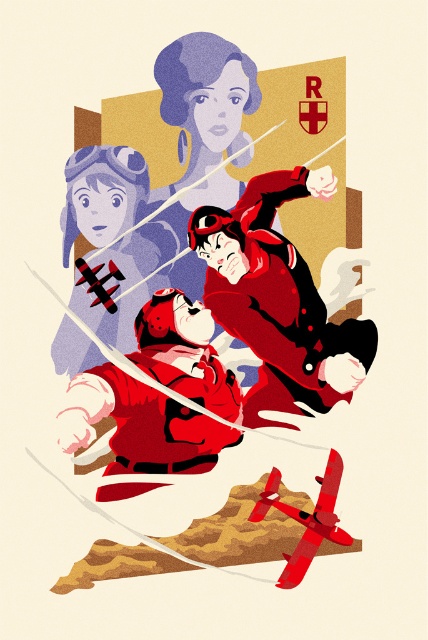
Question: Can you confirm if matte red helmet at center is smaller than matte black helmet at upper left?

Choices:
 (A) no
 (B) yes

Answer: (A)

Question: Which object is the farthest from the matte red uniform at center?

Choices:
 (A) matte black helmet at upper left
 (B) matte red helmet at center

Answer: (A)

Question: Which of the following is the closest to the observer?

Choices:
 (A) (83, 163)
 (B) (228, 252)
 (C) (92, 392)

Answer: (C)

Question: Is matte red uniform at center positioned before matte black helmet at upper left?

Choices:
 (A) no
 (B) yes

Answer: (B)

Question: Does matte red uniform at center appear on the left side of matte black helmet at upper left?

Choices:
 (A) no
 (B) yes

Answer: (A)

Question: Which is farther from the matte black helmet at upper left?

Choices:
 (A) matte red uniform at center
 (B) matte red helmet at center

Answer: (A)